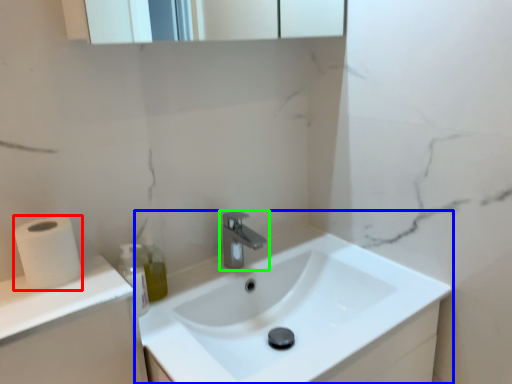
Question: Considering the real-world distances, which object is closest to toilet paper (highlighted by a red box)? sink (highlighted by a blue box) or tap (highlighted by a green box).

Choices:
 (A) sink
 (B) tap

Answer: (B)